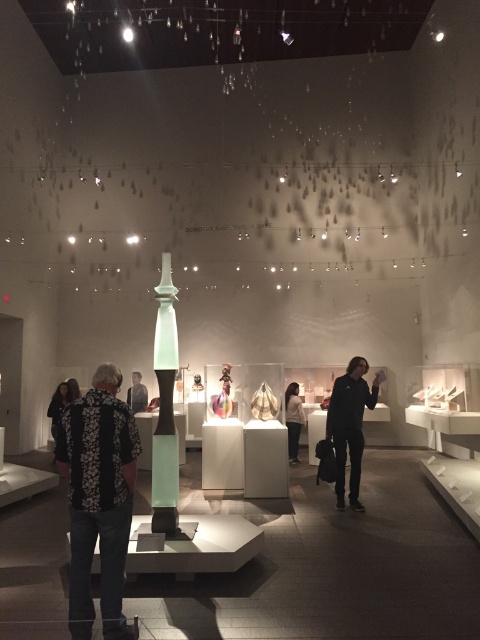
You are standing in the exhibition space and want to pick up both the white matte jacket at center and the dark gray sweater at center. Which one is closer to you?

The white matte jacket at center is 9.57 feet away from the dark gray sweater at center. Since both are at center, they are equally distant from you.

You are an assistant helping a customer in a clothing store. The customer wants to know if the black matte jacket at center will fit over the dark gray sweater at center. Based on their heights, can you determine if the jacket will accommodate the sweater?

The black matte jacket at center is taller than the dark gray sweater at center, so it should accommodate the sweater when worn over it.

You are an artist setting up an exhibition and need to arrange two garments on a display stand. You have a black floral shirt at center and a black textured jacket at left. Based on their widths, which garment should you place on the narrower part of the stand to ensure proper display?

The black floral shirt at center has a lesser width compared to the black textured jacket at left, so it should be placed on the narrower part of the stand.